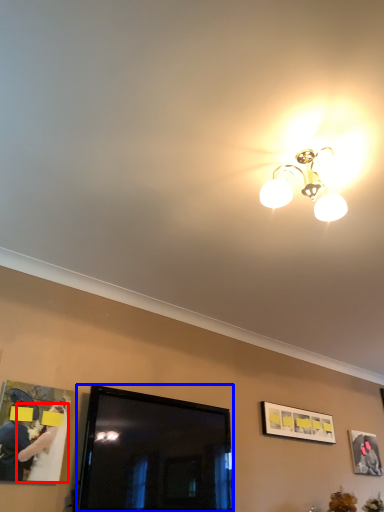
Question: Among these objects, which one is farthest to the camera, woman (highlighted by a red box) or television (highlighted by a blue box)?

Choices:
 (A) woman
 (B) television

Answer: (B)